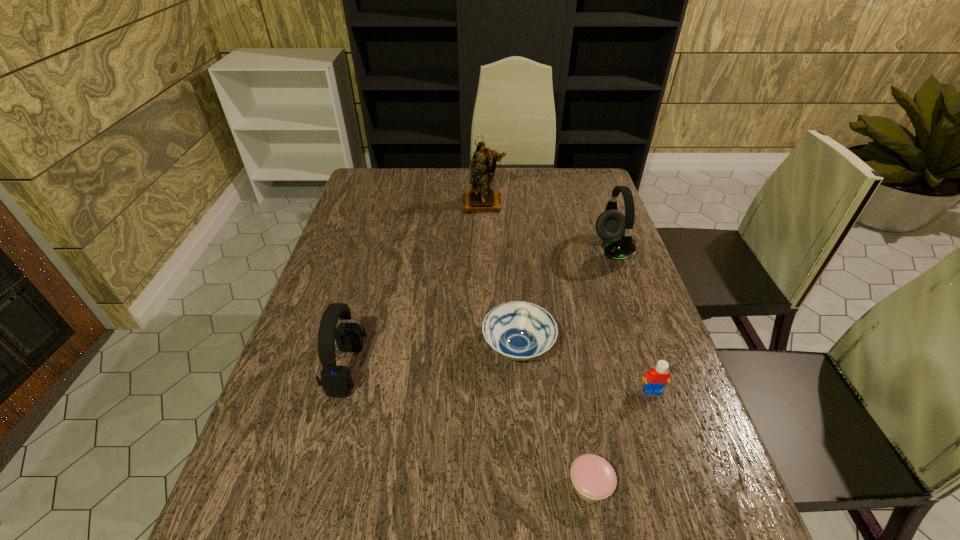
Locate an element on the screen. The image size is (960, 540). the farthest object is located at coordinates (480, 198).

You are a GUI agent. You are given a task and a screenshot of the screen. Output one action in this format:
    pyautogui.click(x=<x>, y=<y>)
    Task: Click on the tallest object
    Image resolution: width=960 pixels, height=540 pixels.
    Given the screenshot: What is the action you would take?
    pyautogui.click(x=480, y=198)

Where is `the farther headset`? This screenshot has height=540, width=960. the farther headset is located at coordinates (611, 225).

Identify the location of the fifth nearest object. This screenshot has height=540, width=960. (611, 225).

Locate an element on the screen. The image size is (960, 540). the nearer headset is located at coordinates (336, 381).

What are the coordinates of `the leftmost object` in the screenshot? It's located at (336, 381).

The width and height of the screenshot is (960, 540). I want to click on Lego, so click(655, 379).

Find the location of a particular element. Image resolution: width=960 pixels, height=540 pixels. the second shortest object is located at coordinates (518, 330).

I want to click on the nearest object, so click(593, 478).

The height and width of the screenshot is (540, 960). I want to click on cupcake, so click(x=593, y=478).